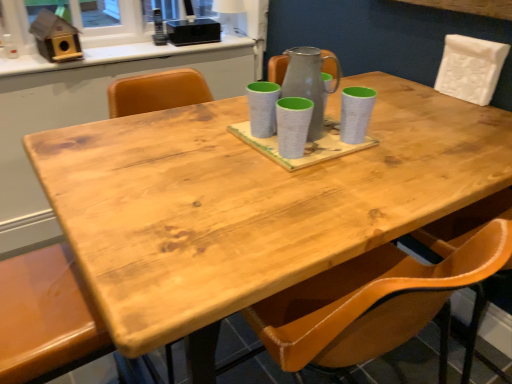
In order to click on free location to the right of matte gray pitcher at center in this screenshot , I will do `click(385, 147)`.